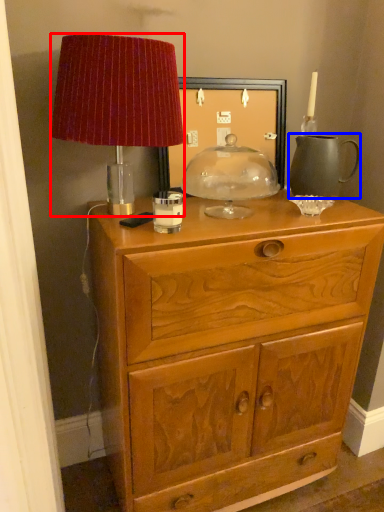
Question: Which of the following is the closest to the observer, lamp (highlighted by a red box) or tea pot (highlighted by a blue box)?

Choices:
 (A) lamp
 (B) tea pot

Answer: (A)